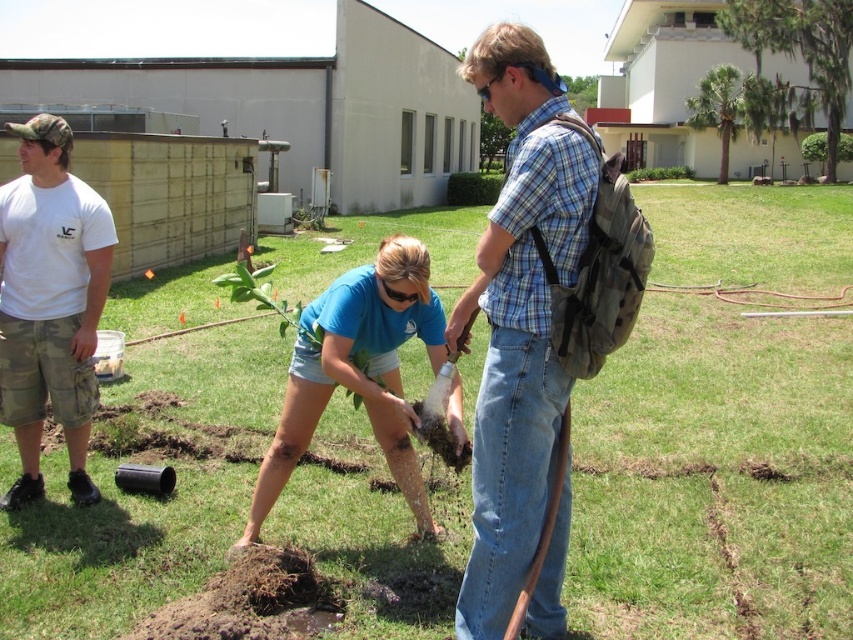
Between green matte plant at center and camo shorts at left, which one appears on the left side from the viewer's perspective?

From the viewer's perspective, camo shorts at left appears more on the left side.

In the scene shown: Can you confirm if green matte plant at center is positioned to the left of camo shorts at left?

Incorrect, green matte plant at center is not on the left side of camo shorts at left.

Which is in front, point (825, 243) or point (86, 266)?

Point (86, 266) is more forward.

At what (x,y) coordinates should I click in order to perform the action: click on green matte plant at center. Please return your answer as a coordinate pair (x, y). This screenshot has height=640, width=853. Looking at the image, I should click on (x=714, y=477).

Between green leafy palm tree at upper right and green leafy plant at center, which one has less height?

With less height is green leafy plant at center.

Who is positioned more to the left, green leafy palm tree at upper right or green leafy plant at center?

green leafy plant at center

Is point (753, 81) positioned before point (677, 177)?

Yes, point (753, 81) is closer to viewer.

Find the location of a particular element. green leafy palm tree at upper right is located at coordinates (730, 106).

Can you confirm if blue plaid shirt at center is positioned to the left of blue cotton shirt at center?

In fact, blue plaid shirt at center is to the right of blue cotton shirt at center.

In order to click on blue plaid shirt at center in this screenshot , I will do `click(518, 317)`.

This screenshot has height=640, width=853. Describe the element at coordinates (518, 317) in the screenshot. I see `blue plaid shirt at center` at that location.

You are a GUI agent. You are given a task and a screenshot of the screen. Output one action in this format:
    pyautogui.click(x=<x>, y=<y>)
    Task: Click on the blue plaid shirt at center
    
    Given the screenshot: What is the action you would take?
    pyautogui.click(x=518, y=317)